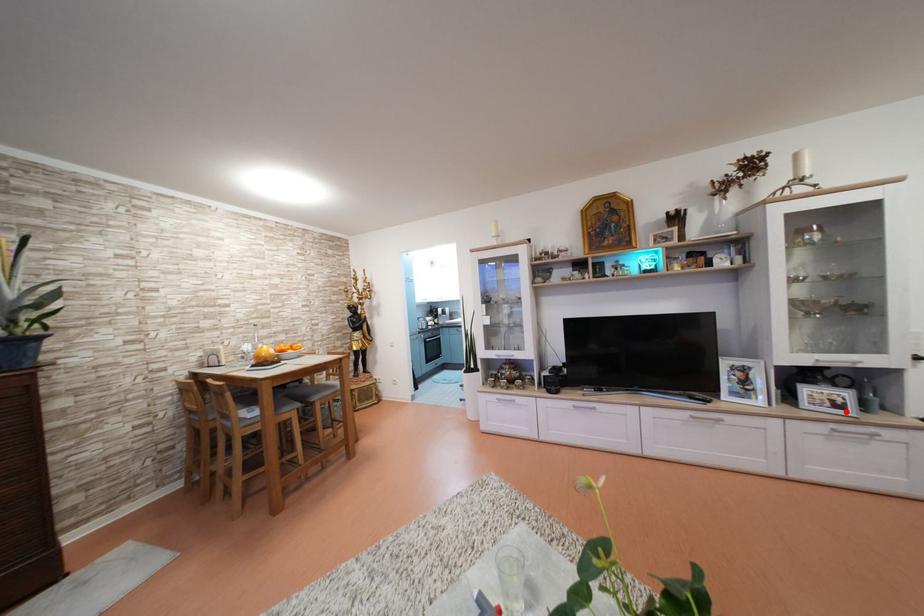
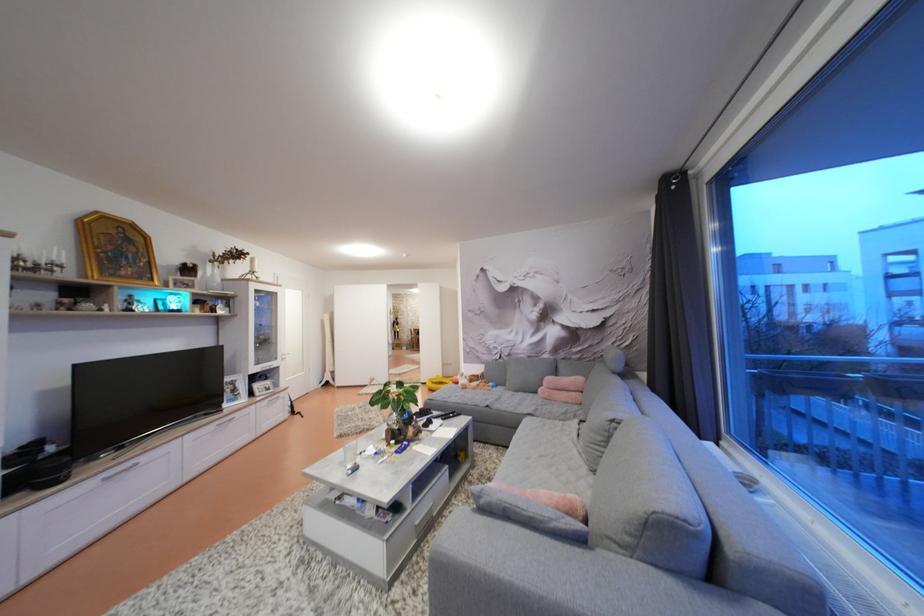
Question: I am providing you with two images of the same scene from different viewpoints. Image1 has a red point marked. In image2, the corresponding 3D location appears at what relative position? Reply with the corresponding letter.

Choices:
 (A) Closer
 (B) Farther

Answer: (B)